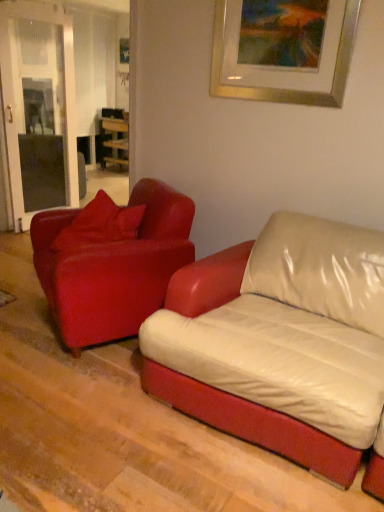
This screenshot has height=512, width=384. What do you see at coordinates (100, 224) in the screenshot?
I see `matte red pillow at left` at bounding box center [100, 224].

The height and width of the screenshot is (512, 384). What do you see at coordinates (114, 268) in the screenshot?
I see `matte red leather couch at left, which ranks as the 2th studio couch in left-to-right order` at bounding box center [114, 268].

Image resolution: width=384 pixels, height=512 pixels. In order to click on leather couch at center, placed as the 2th studio couch when sorted from right to left in this screenshot , I will do [281, 345].

At what (x,y) coordinates should I click in order to perform the action: click on matte red pillow at left. Please return your answer as a coordinate pair (x, y). Looking at the image, I should click on (100, 224).

Based on the photo, between matte red pillow at left and gold metallic picture frame at upper center, which one appears on the right side from the viewer's perspective?

gold metallic picture frame at upper center is more to the right.

Which is farther, (133, 229) or (221, 46)?

The point (133, 229) is more distant.

Between matte red pillow at left and gold metallic picture frame at upper center, which one is positioned behind?

matte red pillow at left is further away from the camera.

Between matte red pillow at left and gold metallic picture frame at upper center, which one has larger width?

With larger width is matte red pillow at left.

From the image's perspective, is leather couch at center, which is the first studio couch in left-to-right order, positioned above or below matte red leather couch at left, which ranks as the 2th studio couch in left-to-right order?

leather couch at center, which is the first studio couch in left-to-right order, is below matte red leather couch at left, which ranks as the 2th studio couch in left-to-right order.

Does leather couch at center, which is the first studio couch in left-to-right order, have a lesser width compared to matte red leather couch at left, positioned as the first studio couch in right-to-left order?

In fact, leather couch at center, which is the first studio couch in left-to-right order, might be wider than matte red leather couch at left, positioned as the first studio couch in right-to-left order.

Is leather couch at center, placed as the 2th studio couch when sorted from right to left, facing away from matte red leather couch at left, positioned as the first studio couch in right-to-left order?

No, leather couch at center, placed as the 2th studio couch when sorted from right to left, is not facing away from matte red leather couch at left, positioned as the first studio couch in right-to-left order.

Which is in front, point (50, 212) or point (53, 243)?

The point (53, 243) is in front.

Which of these two, matte red leather couch at left, which ranks as the 2th studio couch in left-to-right order, or matte red pillow at left, stands taller?

matte red leather couch at left, which ranks as the 2th studio couch in left-to-right order.

Does matte red leather couch at left, which ranks as the 2th studio couch in left-to-right order, contain matte red pillow at left?

That's correct, matte red pillow at left is inside matte red leather couch at left, which ranks as the 2th studio couch in left-to-right order.

Is matte red leather couch at left, positioned as the first studio couch in right-to-left order, far from matte red pillow at left?

They are positioned close to each other.

Looking at their sizes, would you say wooden table at center is wider or thinner than leather couch at center, which is the first studio couch in left-to-right order?

Clearly, wooden table at center has less width compared to leather couch at center, which is the first studio couch in left-to-right order.

From a real-world perspective, which is physically above, wooden table at center or leather couch at center, which is the first studio couch in left-to-right order?

In real-world perspective, wooden table at center is above.

Do you think wooden table at center is within leather couch at center, which is the first studio couch in left-to-right order, or outside of it?

wooden table at center cannot be found inside leather couch at center, which is the first studio couch in left-to-right order.

Relative to leather couch at center, which is the first studio couch in left-to-right order, is wooden table at center in front or behind?

Visually, wooden table at center is located behind leather couch at center, which is the first studio couch in left-to-right order.

Could you measure the distance between leather couch at center, which is the first studio couch in left-to-right order, and gold metallic picture frame at upper center?

They are 1.19 meters apart.

Between leather couch at center, which is the first studio couch in left-to-right order, and gold metallic picture frame at upper center, which one has larger width?

leather couch at center, which is the first studio couch in left-to-right order, is wider.

Considering the sizes of objects leather couch at center, which is the first studio couch in left-to-right order, and gold metallic picture frame at upper center in the image provided, who is taller, leather couch at center, which is the first studio couch in left-to-right order, or gold metallic picture frame at upper center?

gold metallic picture frame at upper center is taller.

Is leather couch at center, which is the first studio couch in left-to-right order, located outside gold metallic picture frame at upper center?

That's correct, leather couch at center, which is the first studio couch in left-to-right order, is outside of gold metallic picture frame at upper center.

From a real-world perspective, which is physically above, matte red pillow at left or matte red leather couch at left, which ranks as the 2th studio couch in left-to-right order?

matte red pillow at left is physically above.

Is the surface of matte red pillow at left in direct contact with matte red leather couch at left, positioned as the first studio couch in right-to-left order?

matte red pillow at left is not next to matte red leather couch at left, positioned as the first studio couch in right-to-left order, and they're not touching.

Is matte red pillow at left looking in the opposite direction of matte red leather couch at left, which ranks as the 2th studio couch in left-to-right order?

Yes, matte red pillow at left is facing away from matte red leather couch at left, which ranks as the 2th studio couch in left-to-right order.

Based on their sizes in the image, would you say matte red pillow at left is bigger or smaller than matte red leather couch at left, positioned as the first studio couch in right-to-left order?

Clearly, matte red pillow at left is smaller in size than matte red leather couch at left, positioned as the first studio couch in right-to-left order.

Measure the distance between matte red leather couch at left, which ranks as the 2th studio couch in left-to-right order, and gold metallic picture frame at upper center.

1.13 meters.

Considering the relative positions of matte red leather couch at left, positioned as the first studio couch in right-to-left order, and gold metallic picture frame at upper center in the image provided, is matte red leather couch at left, positioned as the first studio couch in right-to-left order, to the left or to the right of gold metallic picture frame at upper center?

matte red leather couch at left, positioned as the first studio couch in right-to-left order, is to the left of gold metallic picture frame at upper center.

In the scene shown: From the image's perspective, which is above, matte red leather couch at left, which ranks as the 2th studio couch in left-to-right order, or gold metallic picture frame at upper center?

gold metallic picture frame at upper center.

Is point (62, 315) closer to camera compared to point (293, 94)?

Yes, point (62, 315) is in front of point (293, 94).

Where is `pillow below the gold metallic picture frame at upper center (from the image's perspective)`? pillow below the gold metallic picture frame at upper center (from the image's perspective) is located at coordinates (100, 224).

Locate an element on the screen. The image size is (384, 512). studio couch above the leather couch at center, placed as the 2th studio couch when sorted from right to left (from the image's perspective) is located at coordinates (114, 268).

Looking at the image, which one is located closer to matte red pillow at left, matte red leather couch at left, which ranks as the 2th studio couch in left-to-right order, or leather couch at center, which is the first studio couch in left-to-right order?

matte red leather couch at left, which ranks as the 2th studio couch in left-to-right order, lies closer to matte red pillow at left than the other object.

From the image, which object appears to be nearer to matte red pillow at left, leather couch at center, which is the first studio couch in left-to-right order, or wooden table at center?

The object closer to matte red pillow at left is leather couch at center, which is the first studio couch in left-to-right order.

Considering their positions, is gold metallic picture frame at upper center positioned further to matte red leather couch at left, which ranks as the 2th studio couch in left-to-right order, than wooden table at center?

wooden table at center is further to matte red leather couch at left, which ranks as the 2th studio couch in left-to-right order.

Based on their spatial positions, is matte red pillow at left or leather couch at center, which is the first studio couch in left-to-right order, closer to wooden table at center?

matte red pillow at left.

Which object lies nearer to the anchor point gold metallic picture frame at upper center, leather couch at center, which is the first studio couch in left-to-right order, or wooden table at center?

leather couch at center, which is the first studio couch in left-to-right order, is closer to gold metallic picture frame at upper center.

In the scene shown: Estimate the real-world distances between objects in this image. Which object is further from gold metallic picture frame at upper center, wooden table at center or leather couch at center, placed as the 2th studio couch when sorted from right to left?

wooden table at center lies further to gold metallic picture frame at upper center than the other object.

Estimate the real-world distances between objects in this image. Which object is closer to wooden table at center, matte red leather couch at left, which ranks as the 2th studio couch in left-to-right order, or gold metallic picture frame at upper center?

The object closer to wooden table at center is matte red leather couch at left, which ranks as the 2th studio couch in left-to-right order.

From the image, which object appears to be nearer to matte red leather couch at left, which ranks as the 2th studio couch in left-to-right order, wooden table at center or matte red pillow at left?

Based on the image, matte red pillow at left appears to be nearer to matte red leather couch at left, which ranks as the 2th studio couch in left-to-right order.

Find the location of a particular element. Image resolution: width=384 pixels, height=512 pixels. pillow between gold metallic picture frame at upper center and wooden table at center from front to back is located at coordinates (100, 224).

Where is `pillow between leather couch at center, which is the first studio couch in left-to-right order, and wooden table at center in the front-back direction`? pillow between leather couch at center, which is the first studio couch in left-to-right order, and wooden table at center in the front-back direction is located at coordinates (100, 224).

Where is `studio couch positioned between gold metallic picture frame at upper center and wooden table at center from near to far`? studio couch positioned between gold metallic picture frame at upper center and wooden table at center from near to far is located at coordinates (114, 268).

The width and height of the screenshot is (384, 512). In order to click on pillow between matte red leather couch at left, positioned as the first studio couch in right-to-left order, and wooden table at center, along the z-axis in this screenshot , I will do `click(100, 224)`.